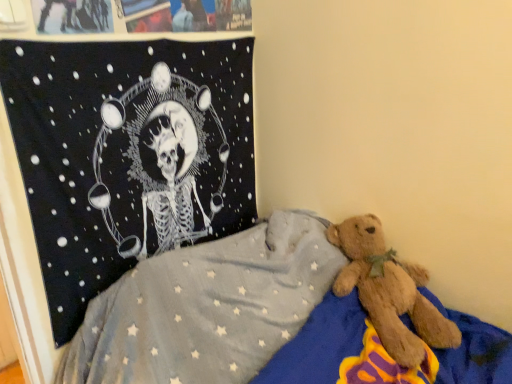
Question: Considering the relative sizes of soft blue blanket with star pattern at center and black fabric tapestry at upper left in the image provided, is soft blue blanket with star pattern at center wider than black fabric tapestry at upper left?

Choices:
 (A) yes
 (B) no

Answer: (A)

Question: Does soft blue blanket with star pattern at center have a lesser width compared to black fabric tapestry at upper left?

Choices:
 (A) yes
 (B) no

Answer: (B)

Question: Is soft blue blanket with star pattern at center closer to the viewer compared to black fabric tapestry at upper left?

Choices:
 (A) yes
 (B) no

Answer: (A)

Question: Considering the relative sizes of soft blue blanket with star pattern at center and black fabric tapestry at upper left in the image provided, is soft blue blanket with star pattern at center bigger than black fabric tapestry at upper left?

Choices:
 (A) no
 (B) yes

Answer: (B)

Question: Does soft blue blanket with star pattern at center appear on the left side of black fabric tapestry at upper left?

Choices:
 (A) no
 (B) yes

Answer: (A)

Question: Considering the relative sizes of soft blue blanket with star pattern at center and black fabric tapestry at upper left in the image provided, is soft blue blanket with star pattern at center taller than black fabric tapestry at upper left?

Choices:
 (A) yes
 (B) no

Answer: (B)

Question: Is black fabric tapestry at upper left with soft blue blanket with star pattern at center?

Choices:
 (A) no
 (B) yes

Answer: (A)

Question: From a real-world perspective, is black fabric tapestry at upper left positioned under soft blue blanket with star pattern at center based on gravity?

Choices:
 (A) no
 (B) yes

Answer: (A)

Question: Is soft blue blanket with star pattern at center located within black fabric tapestry at upper left?

Choices:
 (A) no
 (B) yes

Answer: (A)

Question: Is the depth of black fabric tapestry at upper left less than that of soft blue blanket with star pattern at center?

Choices:
 (A) no
 (B) yes

Answer: (A)

Question: Are black fabric tapestry at upper left and soft blue blanket with star pattern at center located far from each other?

Choices:
 (A) no
 (B) yes

Answer: (A)

Question: Can you confirm if black fabric tapestry at upper left is shorter than soft blue blanket with star pattern at center?

Choices:
 (A) yes
 (B) no

Answer: (B)

Question: Is black fabric tapestry at upper left taller or shorter than soft blue blanket with star pattern at center?

Choices:
 (A) short
 (B) tall

Answer: (B)